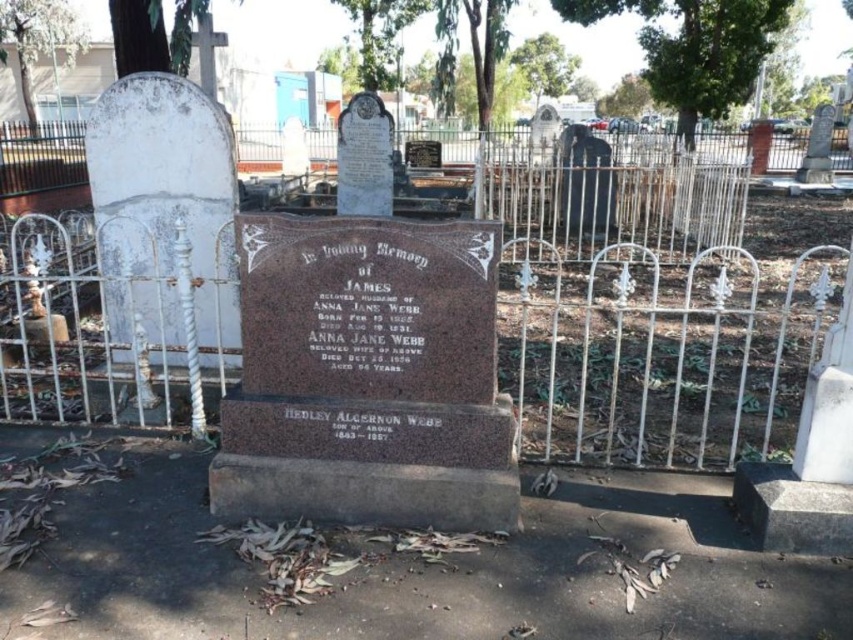
You are a groundskeeper tasked with maintaining the cemetery. You need to place a new decorative wreath on the brown polished stone gravestone at center. The wreath is 1 meter in diameter. Can the white wrought iron fence at center allow you to place the wreath without obstruction?

The white wrought iron fence at center occupies less space than the brown polished stone gravestone at center, so the fence is smaller in size. Since the wreath is 1 meter in diameter, it should fit around the fence as long as there is enough space between the fence and the gravestone. However, the exact placement would depend on the available space between them, which isn

In the scene shown: You are a visitor at the cemetery and want to place a bouquet of flowers on the brown polished stone gravestone at center. The bouquet is 1.2 meters tall. Can the white wrought iron fence at center block you from placing the bouquet on the gravestone?

The white wrought iron fence at center is shorter than the brown polished stone gravestone at center, so the fence will not block placing the bouquet as it is shorter than the gravestone. However, the height of the fence itself is not specified, so it is possible the fence could still block access depending on its own height.

You are standing at the center of the cemetery looking at the white wrought iron fence. There is a point marked at coordinates [659,353]. Which object does this point belong to?

The point at coordinates [659,353] is on the white wrought iron fence at center.